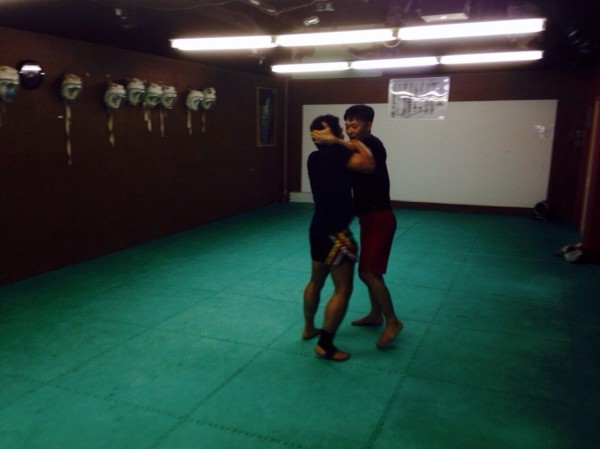
This screenshot has width=600, height=449. Find the location of `floor`. floor is located at coordinates (248, 360).